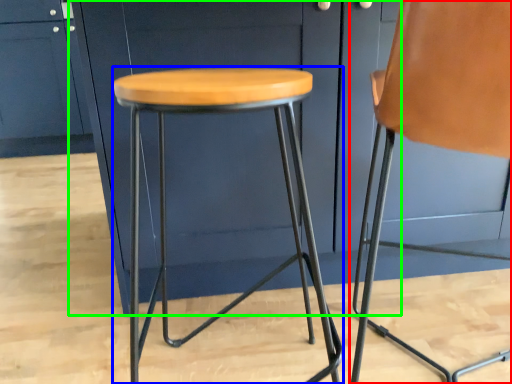
Question: Which is farther away from chair (highlighted by a red box)? stool (highlighted by a blue box) or cabinetry (highlighted by a green box)?

Choices:
 (A) stool
 (B) cabinetry

Answer: (B)